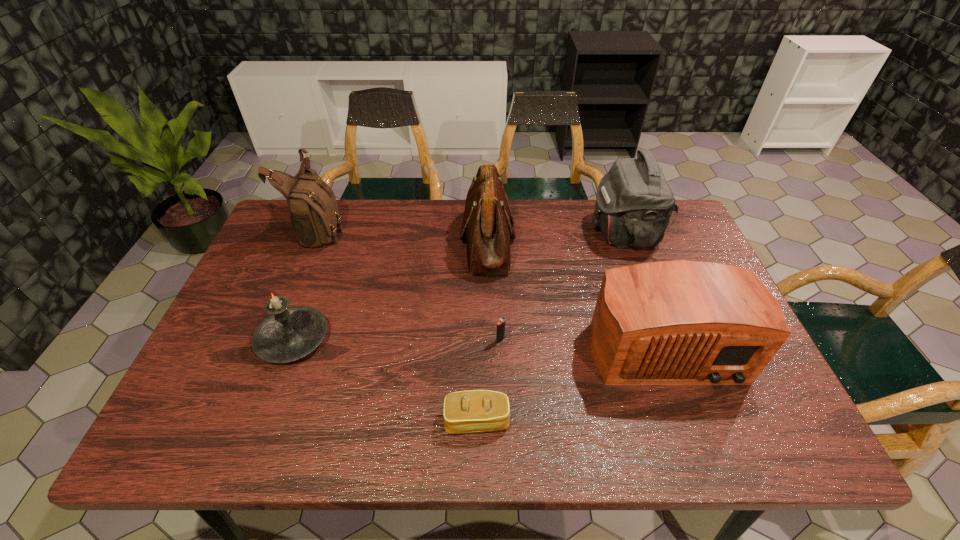
The image size is (960, 540). I want to click on free space located 0.110m on the open flap of the rightmost shoulder bag, so click(554, 233).

This screenshot has height=540, width=960. I want to click on vacant space located 0.210m on the open flap of the rightmost shoulder bag, so click(522, 233).

At what (x,y) coordinates should I click in order to perform the action: click on vacant space located 0.280m on the left of the second shoulder bag from right to left. Please return your answer as a coordinate pair (x, y). This screenshot has height=540, width=960. Looking at the image, I should click on (369, 241).

I want to click on vacant area situated on the front-facing side of the radio receiver, so point(691,421).

Identify the location of free region located 0.240m on the back of the third shortest object. This screenshot has width=960, height=540. (325, 251).

This screenshot has height=540, width=960. In order to click on vacant position located 0.060m on the left of the sixth tallest object in this screenshot , I will do `click(471, 340)`.

Where is `object at the near edge`? The height and width of the screenshot is (540, 960). object at the near edge is located at coordinates (468, 411).

Locate an element on the screen. The image size is (960, 540). shoulder bag at the left edge is located at coordinates (314, 214).

The height and width of the screenshot is (540, 960). In order to click on candle at the left edge in this screenshot , I will do `click(289, 333)`.

Locate an element on the screen. Image resolution: width=960 pixels, height=540 pixels. shoulder bag situated at the right edge is located at coordinates (634, 203).